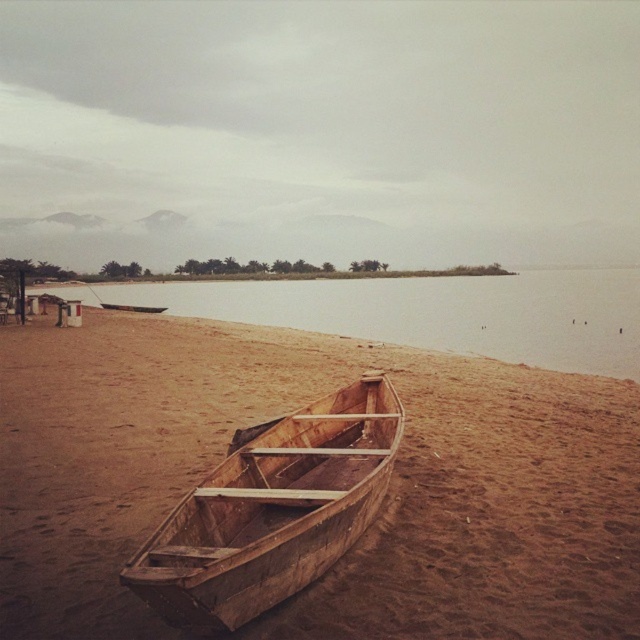
Is brown sand at lower left behind wooden canoe at center?

No, brown sand at lower left is closer to the viewer.

Is brown sand at lower left taller than wooden canoe at center?

Indeed, brown sand at lower left has a greater height compared to wooden canoe at center.

What do you see at coordinates (436, 312) in the screenshot?
I see `brown sand at lower left` at bounding box center [436, 312].

Identify the location of brown sand at lower left. The width and height of the screenshot is (640, 640). (436, 312).

The height and width of the screenshot is (640, 640). What do you see at coordinates (273, 509) in the screenshot?
I see `wooden boat at center` at bounding box center [273, 509].

This screenshot has width=640, height=640. Describe the element at coordinates (273, 509) in the screenshot. I see `wooden boat at center` at that location.

The image size is (640, 640). Find the location of `wooden boat at center`. wooden boat at center is located at coordinates (273, 509).

Between point (8, 428) and point (272, 509), which one is positioned behind?

Positioned behind is point (8, 428).

Can you confirm if brown wooden boat at center is wider than wooden boat at center?

Indeed, brown wooden boat at center has a greater width compared to wooden boat at center.

Between point (518, 456) and point (284, 547), which one is positioned in front?

Point (284, 547)

Locate an element on the screen. brown wooden boat at center is located at coordinates (378, 515).